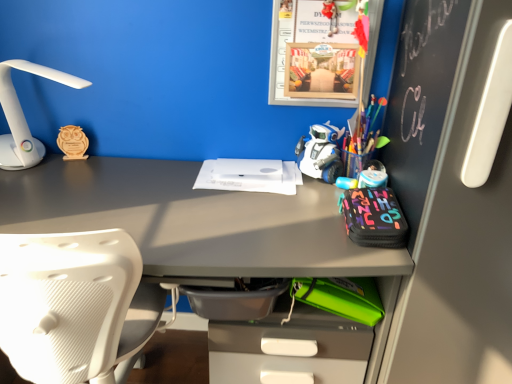
Question: Is wooden owl at left thinner than white plastic robot at center?

Choices:
 (A) yes
 (B) no

Answer: (A)

Question: From the image's perspective, is wooden owl at left beneath white plastic robot at center?

Choices:
 (A) yes
 (B) no

Answer: (B)

Question: Is wooden owl at left wider than white plastic robot at center?

Choices:
 (A) yes
 (B) no

Answer: (B)

Question: Is wooden owl at left positioned far away from white plastic robot at center?

Choices:
 (A) yes
 (B) no

Answer: (B)

Question: Considering the relative positions of wooden owl at left and white plastic robot at center in the image provided, is wooden owl at left to the right of white plastic robot at center from the viewer's perspective?

Choices:
 (A) no
 (B) yes

Answer: (A)

Question: Looking at their shapes, would you say white plastic robot at center is wider or thinner than white matte paper at center?

Choices:
 (A) wide
 (B) thin

Answer: (B)

Question: From the image's perspective, is white plastic robot at center above or below white matte paper at center?

Choices:
 (A) below
 (B) above

Answer: (B)

Question: Considering the relative positions of white plastic robot at center and white matte paper at center in the image provided, is white plastic robot at center to the left or to the right of white matte paper at center?

Choices:
 (A) left
 (B) right

Answer: (B)

Question: Is point (310, 162) closer or farther from the camera than point (224, 162)?

Choices:
 (A) farther
 (B) closer

Answer: (B)

Question: Considering the positions of white plastic lamp at left and white textured chair at left in the image, is white plastic lamp at left bigger or smaller than white textured chair at left?

Choices:
 (A) small
 (B) big

Answer: (A)

Question: Considering the positions of white plastic lamp at left and white textured chair at left in the image, is white plastic lamp at left taller or shorter than white textured chair at left?

Choices:
 (A) short
 (B) tall

Answer: (A)

Question: Would you say white plastic lamp at left is to the left or to the right of white textured chair at left in the picture?

Choices:
 (A) left
 (B) right

Answer: (A)

Question: From a real-world perspective, is white plastic lamp at left above or below white textured chair at left?

Choices:
 (A) above
 (B) below

Answer: (A)

Question: Relative to wooden owl at left, is white textured chair at left in front or behind?

Choices:
 (A) front
 (B) behind

Answer: (A)

Question: Is point (111, 322) closer or farther from the camera than point (62, 129)?

Choices:
 (A) closer
 (B) farther

Answer: (A)